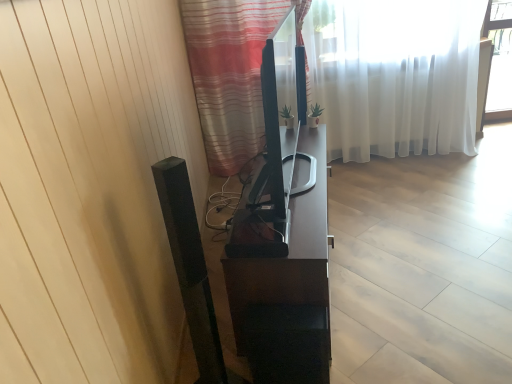
In order to click on space that is in front of white sheer curtain at upper center, which ranks as the 2th curtain in front-to-back order in this screenshot , I will do `click(388, 228)`.